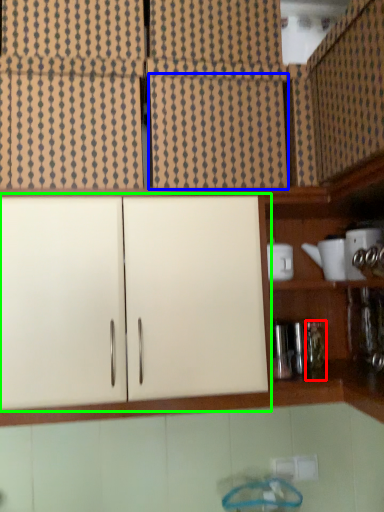
Question: Which is farther away from bottle (highlighted by a red box)? cabinetry (highlighted by a blue box) or cabinetry (highlighted by a green box)?

Choices:
 (A) cabinetry
 (B) cabinetry

Answer: (A)